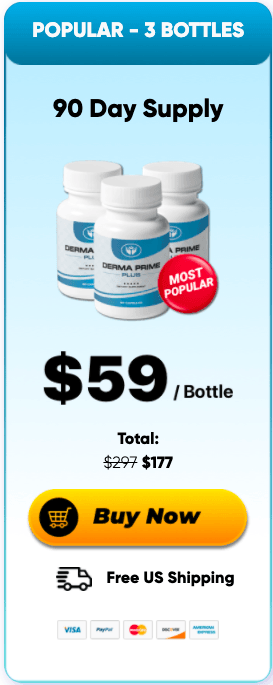
Find the location of `bottle`. bottle is located at coordinates (74, 294).